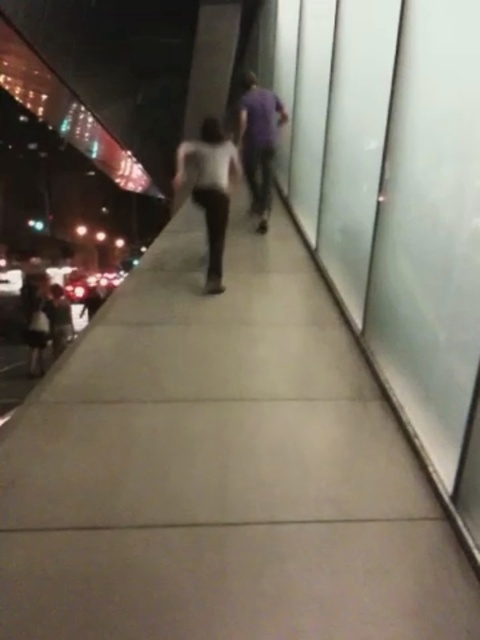
You are standing on the gray concrete pavement at center and looking towards the purple matte shirt at center. Which object is closer to you?

The gray concrete pavement at center is closer to you because it is positioned under the purple matte shirt at center.

Based on the photo, you are a delivery robot with a 3.5 feet wide package. You need to move along the gray concrete pavement at center while avoiding the white matte shirt at center. Is there enough space for you to pass safely?

The distance between the gray concrete pavement at center and the white matte shirt at center is 6.94 feet. Since the robot with the package is 3.5 feet wide, there is sufficient space to pass safely as 6.94 feet is greater than 3.5 feet.